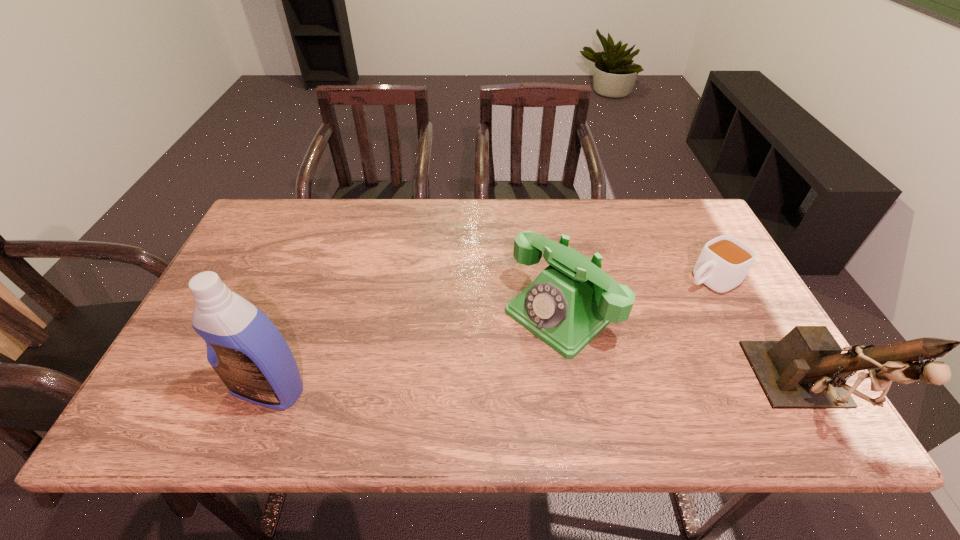
Locate an element on the screen. free space on the desktop that is between the leftmost object and the figurine and is positioned on the dial of the telephone is located at coordinates (469, 391).

Find the location of `free space on the desktop that is between the detergent and the figurine and is positioned on the side with the handle of the shortest object`. free space on the desktop that is between the detergent and the figurine and is positioned on the side with the handle of the shortest object is located at coordinates [x=496, y=392].